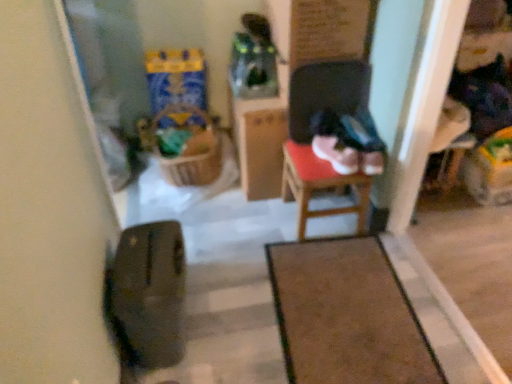
Find the location of a particular element. The width and height of the screenshot is (512, 384). free space above wooden chair at center (from a real-world perspective) is located at coordinates (317, 158).